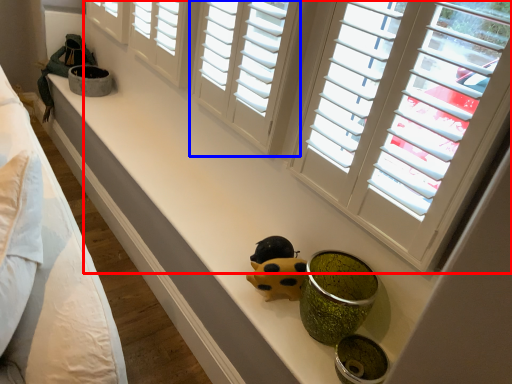
Question: Which object is closer to the camera taking this photo, window (highlighted by a red box) or window (highlighted by a blue box)?

Choices:
 (A) window
 (B) window

Answer: (A)